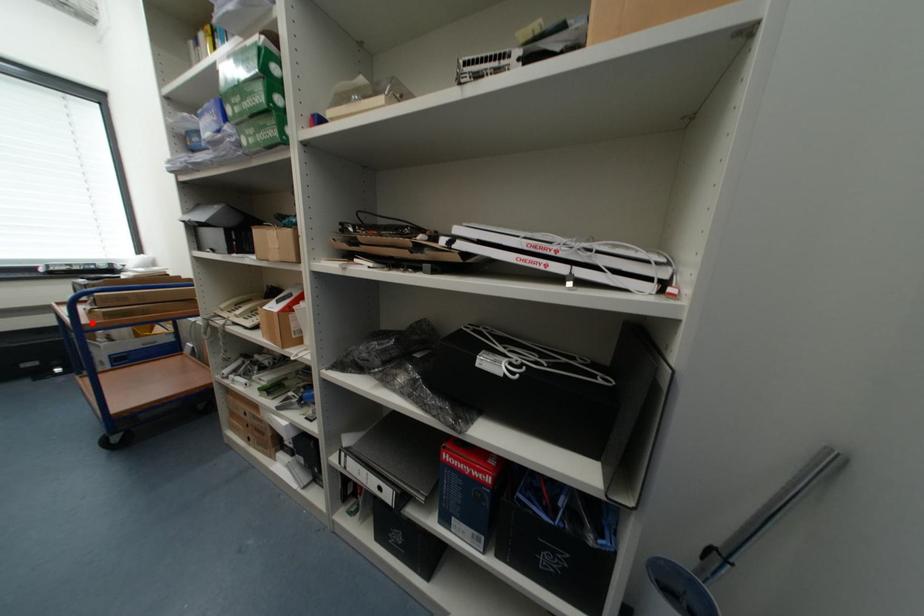
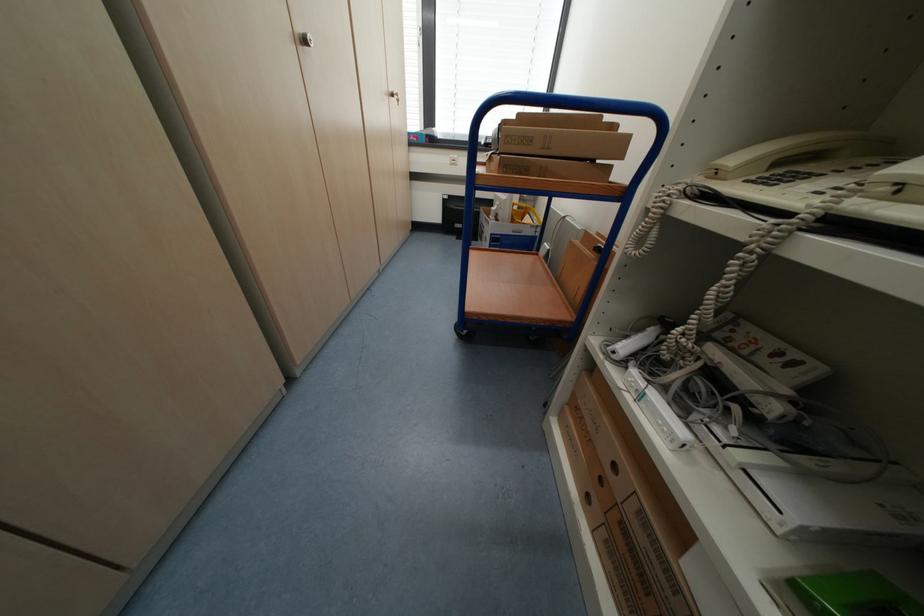
Question: I am providing you with two images of the same scene from different viewpoints. Given a red point in image1, look at the same physical point in image2. Is it:

Choices:
 (A) Closer to the viewpoint
 (B) Farther from the viewpoint

Answer: (B)